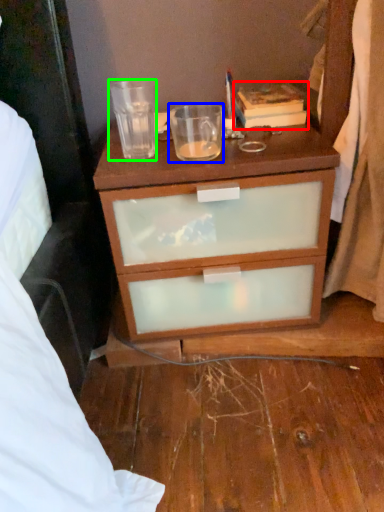
Question: Which object is positioned farthest from book (highlighted by a red box)? Select from coffee cup (highlighted by a blue box) and coffee cup (highlighted by a green box).

Choices:
 (A) coffee cup
 (B) coffee cup

Answer: (B)